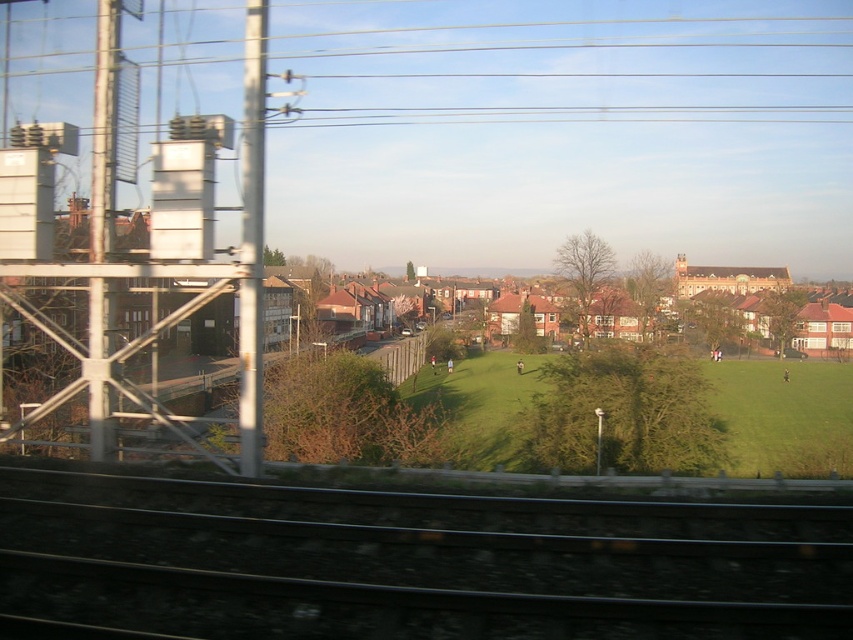
From the picture: You are a surveyor measuring distances between railway infrastructure and nearby fields for safety compliance. The safety regulation requires a minimum distance of 40 meters between the black metal track at bottom and green grass field at center. Based on the image, does the current distance meet the safety requirement?

The black metal track at bottom and green grass field at center are 43.95 meters apart, which exceeds the required 40 meters, so the safety regulation is met.

You are a passenger on the train and looking out the window. You see the black metal track at bottom and the green grass field at center. Which object is closer to you?

The black metal track at bottom is closer to you because it is located above the green grass field at center, meaning it is positioned nearer in the scene.